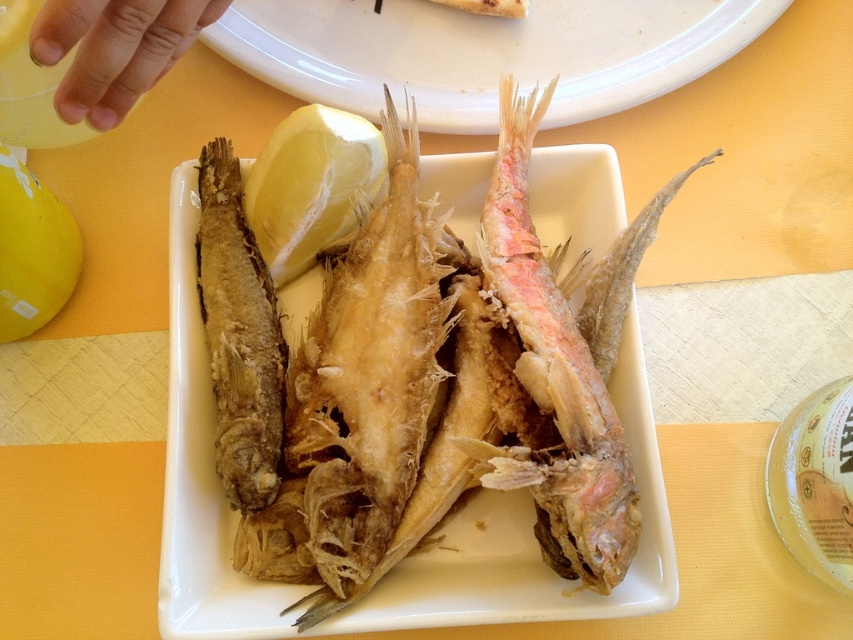
Question: Can you confirm if pinkish-brown crispy fish at center is wider than nail polish at upper left?

Choices:
 (A) no
 (B) yes

Answer: (B)

Question: Which of these objects is positioned farthest from the fried fish at center?

Choices:
 (A) nail polish at upper left
 (B) golden fried fish at center

Answer: (A)

Question: Which point is farther to the camera?

Choices:
 (A) fried fish at center
 (B) golden crispy fish at center

Answer: (A)

Question: Does yellow matte lemon at center have a smaller size compared to nail polish at upper left?

Choices:
 (A) yes
 (B) no

Answer: (B)

Question: Which object is farther from the camera taking this photo?

Choices:
 (A) yellow matte lemon at center
 (B) nail polish at upper left
 (C) golden crispy fish at center
 (D) pinkish-brown crispy fish at center

Answer: (A)

Question: Does fried fish at center have a smaller size compared to nail polish at upper left?

Choices:
 (A) yes
 (B) no

Answer: (B)